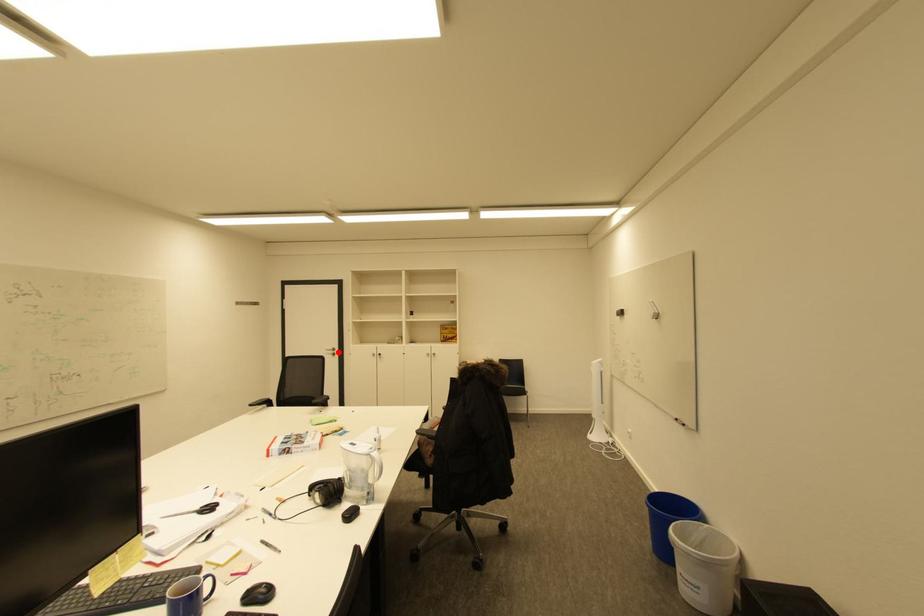
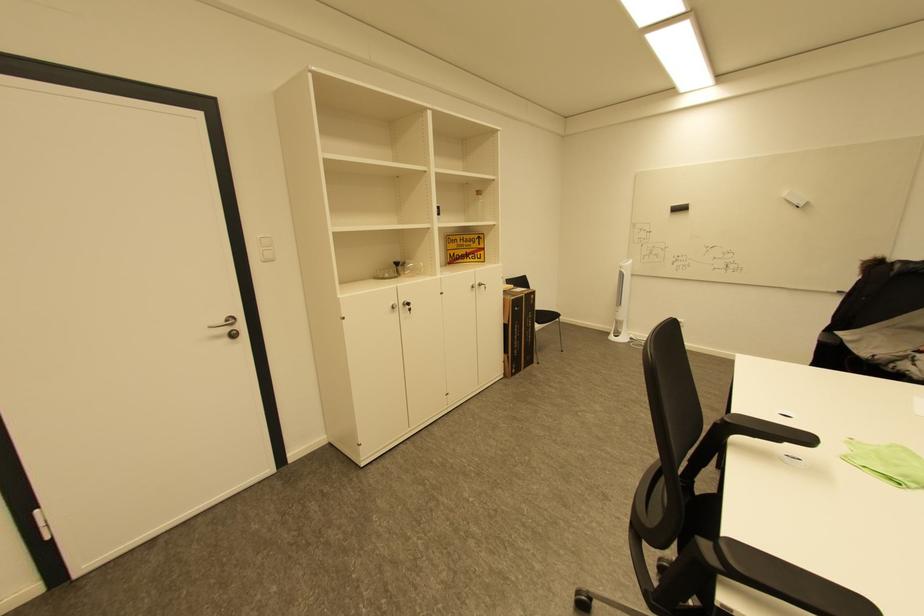
Find the pixel in the second image that matches the highlighted location in the first image.

(233, 330)